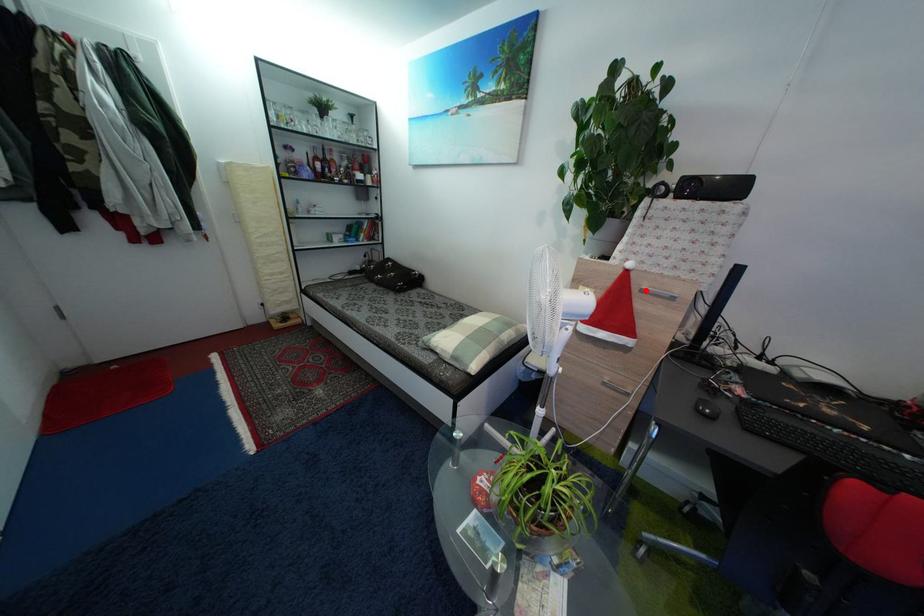
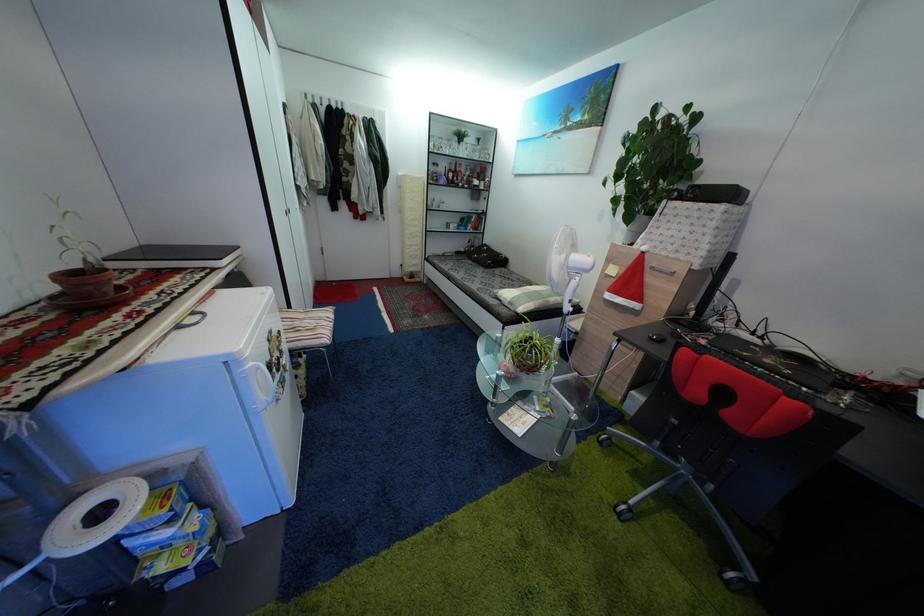
Locate, in the second image, the point that corresponds to the highlighted location in the first image.

(659, 270)